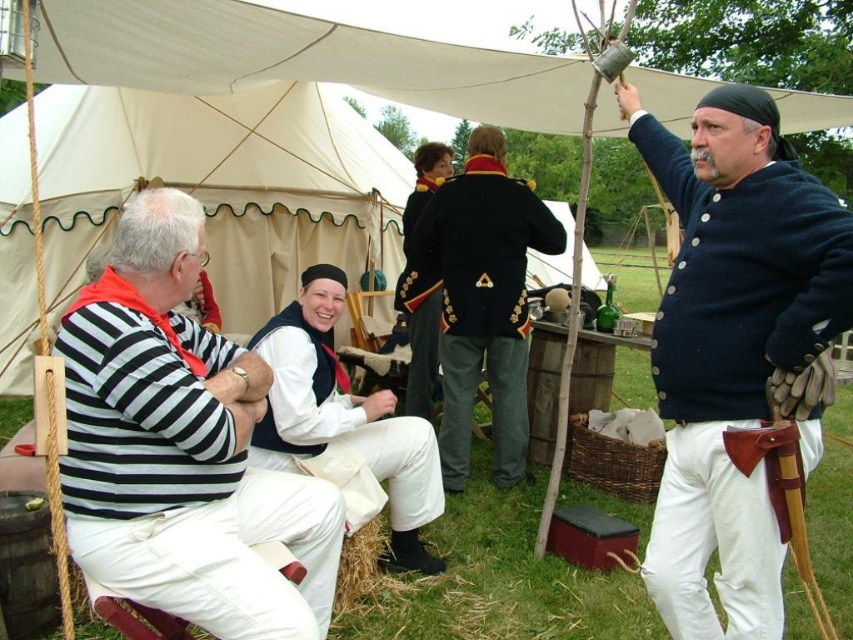
Can you confirm if white cotton vest at center is taller than shiny black coat at center?

Incorrect, white cotton vest at center's height is not larger of shiny black coat at center's.

Based on the photo, which is below, white cotton vest at center or shiny black coat at center?

white cotton vest at center

Is point (277, 465) closer to viewer compared to point (413, 289)?

Yes.

Identify the location of white cotton vest at center. This screenshot has width=853, height=640. (340, 413).

Is the position of striped cotton shirt at center more distant than that of shiny black coat at center?

No, striped cotton shirt at center is closer to the viewer.

Is point (171, 211) positioned behind point (416, 172)?

That is False.

Describe the element at coordinates (181, 448) in the screenshot. This screenshot has width=853, height=640. I see `striped cotton shirt at center` at that location.

Where is `striped cotton shirt at center`? Image resolution: width=853 pixels, height=640 pixels. striped cotton shirt at center is located at coordinates (181, 448).

Which of these two, striped cotton shirt at center or dark blue woolen coat at center, stands shorter?

Standing shorter between the two is striped cotton shirt at center.

Can you confirm if striped cotton shirt at center is positioned above dark blue woolen coat at center?

No.

Which is in front, point (173, 196) or point (473, 200)?

Point (173, 196) is in front.

What are the coordinates of `striped cotton shirt at center` in the screenshot? It's located at (181, 448).